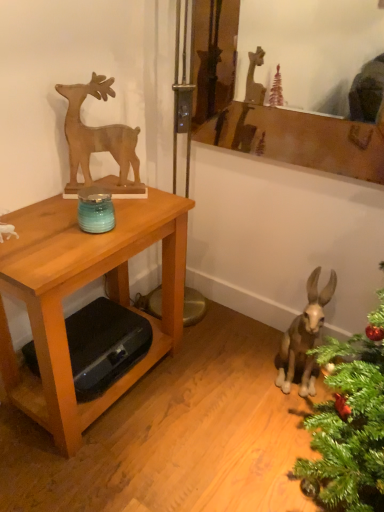
Question: From a real-world perspective, is wooden table at left physically located above or below wooden deer at upper left?

Choices:
 (A) below
 (B) above

Answer: (A)

Question: Would you say wooden table at left is to the left or to the right of wooden deer at upper left in the picture?

Choices:
 (A) right
 (B) left

Answer: (B)

Question: Which of these objects is positioned farthest from the wooden deer at upper left?

Choices:
 (A) wooden mirror at upper center
 (B) brown matte donkey at lower right
 (C) wooden table at left

Answer: (A)

Question: Which object is the farthest from the wooden table at left?

Choices:
 (A) brown matte donkey at lower right
 (B) wooden deer at upper left
 (C) wooden mirror at upper center

Answer: (C)